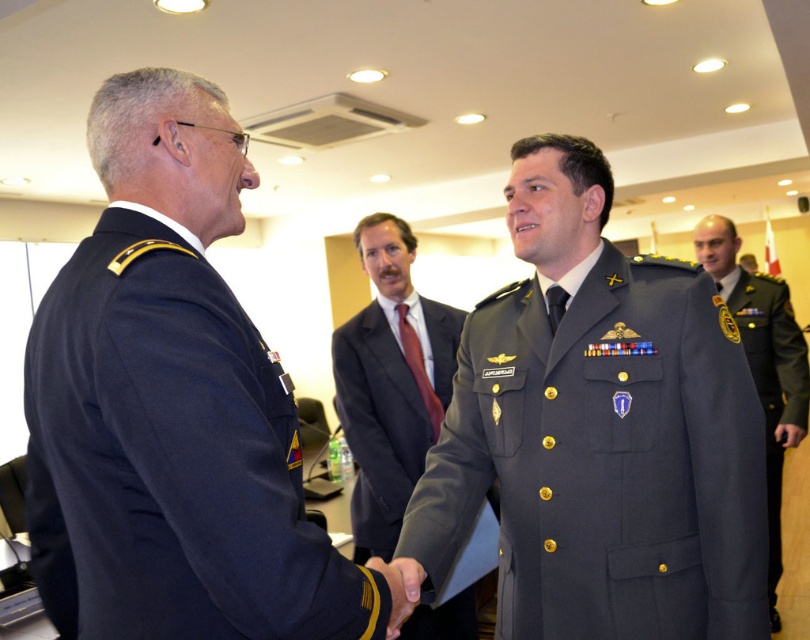
Does point (399, 413) lie in front of point (698, 257)?

Yes.

Where is `dark gray suit at center`? This screenshot has width=810, height=640. dark gray suit at center is located at coordinates (378, 426).

Who is more distant from viewer, (463, 618) or (766, 564)?

Point (463, 618)

This screenshot has height=640, width=810. In order to click on dark gray suit at center in this screenshot , I will do `click(378, 426)`.

Which is more to the left, matte gray uniform at center or dark gray uniform at center?

matte gray uniform at center is more to the left.

Is point (748, 481) less distant than point (752, 282)?

That is True.

Locate an element on the screen. matte gray uniform at center is located at coordinates (599, 433).

Is navy blue uniform at center above dark gray suit at center?

Yes, navy blue uniform at center is above dark gray suit at center.

Is the position of navy blue uniform at center more distant than that of dark gray suit at center?

No.

Which is behind, point (275, 394) or point (373, 364)?

The point (373, 364) is behind.

Where is `navy blue uniform at center`? This screenshot has width=810, height=640. navy blue uniform at center is located at coordinates (x=173, y=406).